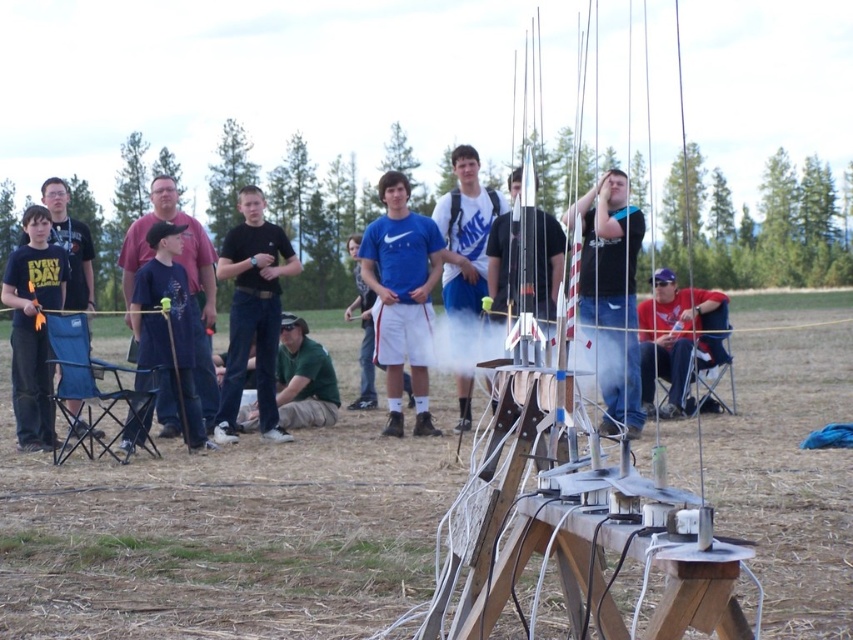
You are a photographer standing at the edge of the field, wanting to take a photo that includes both the point at coordinates point [229,323] and point [480,252]. Given their positions, which point will appear larger in the photo?

Point [229,323] is closer to the camera than point [480,252], so it will appear larger in the photo.

You are a photographer positioned at the center of the field. You want to capture a photo where the red cotton shirt at lower right and the black cotton shirt at left are both visible. Considering their heights, which shirt will appear taller in the photo?

The red cotton shirt at lower right will appear taller in the photo because it has a greater height compared to the black cotton shirt at left.